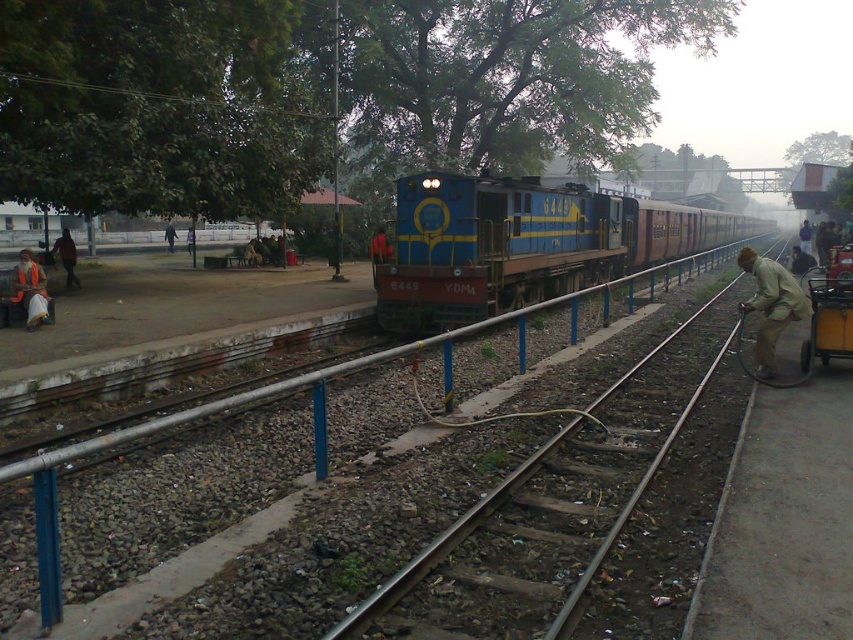
You are a station employee who needs to move a brown fabric cart at right through a narrow passage between two blue painted metal train at center. Can you pass through the passage if the passage width is equal to the cart width?

The blue painted metal train at center is wider than the brown fabric cart at right. Since the passage width is equal to the cart width, the cart can just barely pass through the passage as the train is wider, allowing enough space.

You are a passenger waiting at the platform. You see the blue painted metal train at center and the light brown fabric bag at center. Which object is closer to you?

The blue painted metal train at center is closer to you because it is in front of the light brown fabric bag at center.

You are a pedestrian standing on the platform and want to walk from the blue painted metal train at center to the brown fabric cart at right. Which direction should you move in?

The blue painted metal train at center is in front of the brown fabric cart at right, so you should move backward or to the rear to reach the brown fabric cart at right.